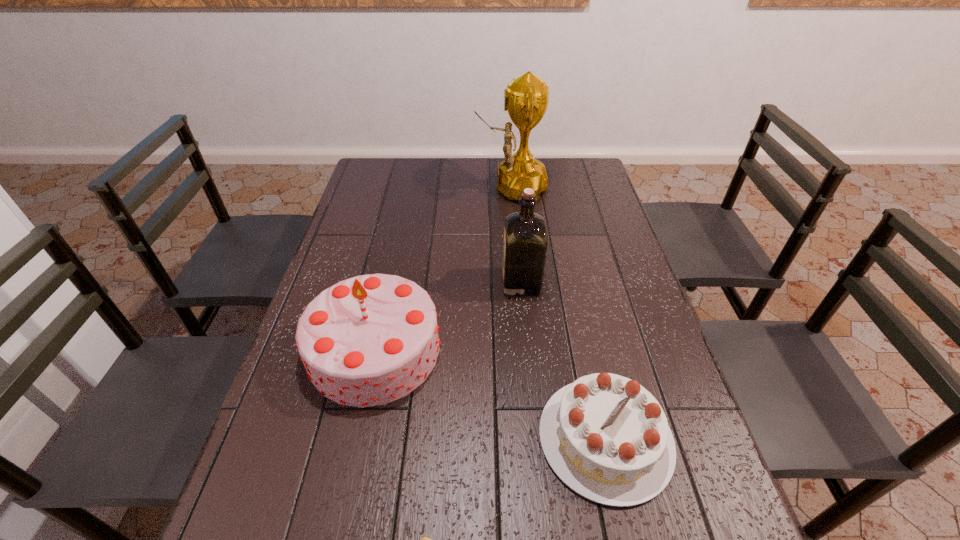
This screenshot has width=960, height=540. Identify the location of vacant region that satisfies the following two spatial constraints: 1. on the front side of the tallest object; 2. on the front side of the taller birthday cake. (526, 349).

Identify the location of vacant space that satisfies the following two spatial constraints: 1. on the label of the second tallest object; 2. on the right side of the right birthday cake. (537, 438).

Locate an element on the screen. vacant space that satisfies the following two spatial constraints: 1. on the label of the shorter birthday cake; 2. on the right side of the second farthest object is located at coordinates (537, 438).

Where is `vacant position in the image that satisfies the following two spatial constraints: 1. on the label of the second tallest object; 2. on the front side of the taller birthday cake`? vacant position in the image that satisfies the following two spatial constraints: 1. on the label of the second tallest object; 2. on the front side of the taller birthday cake is located at coordinates [528, 349].